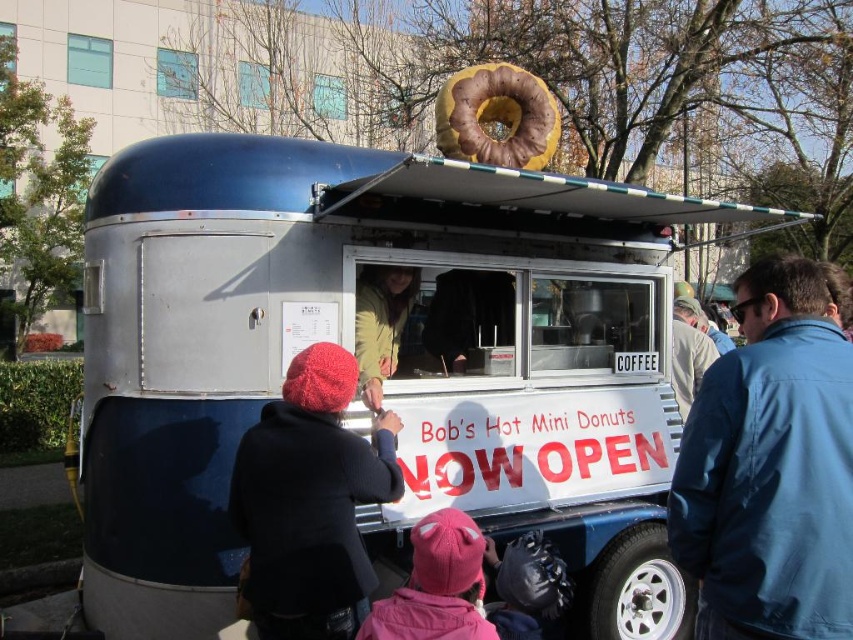
Question: Does metallic silver food truck at center have a lesser width compared to blue fabric jacket at center right?

Choices:
 (A) no
 (B) yes

Answer: (A)

Question: Can you confirm if metallic silver food truck at center is positioned to the right of pink fleece hat at lower center?

Choices:
 (A) no
 (B) yes

Answer: (A)

Question: Which point appears closest to the camera in this image?

Choices:
 (A) (323, 388)
 (B) (466, 596)

Answer: (B)

Question: Does metallic silver food truck at center have a larger size compared to blue fabric jacket at center right?

Choices:
 (A) yes
 (B) no

Answer: (A)

Question: Among these points, which one is farthest from the camera?

Choices:
 (A) (479, 579)
 (B) (323, 508)
 (C) (498, 113)
 (D) (149, 202)

Answer: (C)

Question: Which is nearer to the pink fleece hat at lower center?

Choices:
 (A) knitted wool hat at lower left
 (B) blue fabric jacket at center right
 (C) metallic silver food truck at center

Answer: (A)